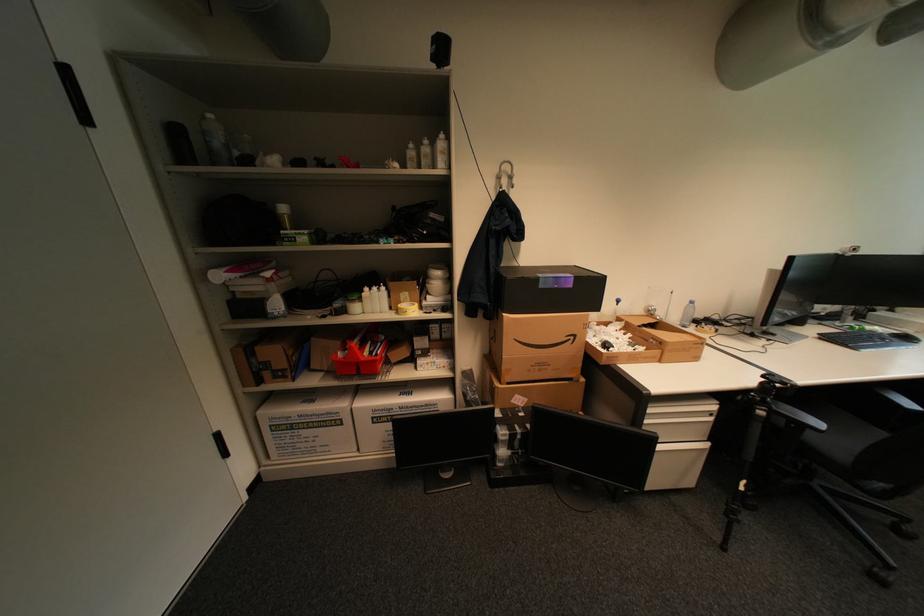
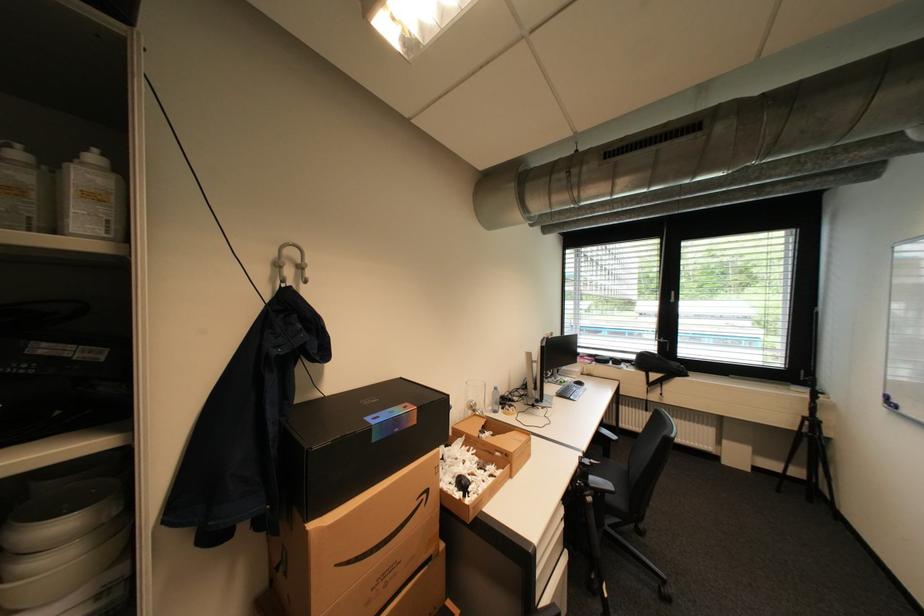
Where in the second image is the point corresponding to pixel 659 307 from the first image?

(480, 402)